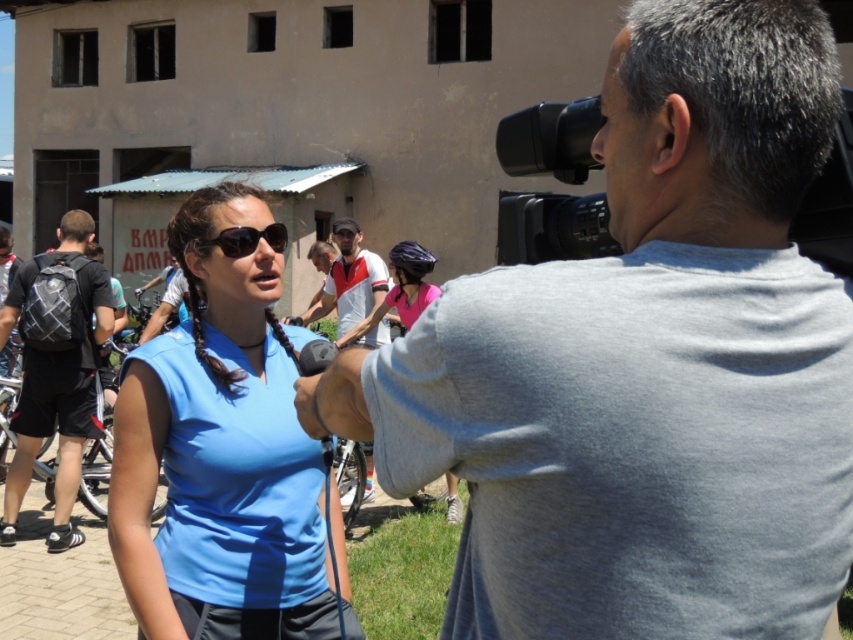
Does point (372, 300) come closer to viewer compared to point (230, 252)?

That is False.

Is white cotton shirt at center in front of black matte sunglasses at center?

No, white cotton shirt at center is behind black matte sunglasses at center.

Who is more forward, (335,308) or (235,252)?

Positioned in front is point (235,252).

At what (x,y) coordinates should I click in order to perform the action: click on white cotton shirt at center. Please return your answer as a coordinate pair (x, y). Image resolution: width=853 pixels, height=640 pixels. Looking at the image, I should click on (351, 289).

Who is shorter, black plastic video camera at upper right or white/red jersey at center?

Standing shorter between the two is white/red jersey at center.

Is point (596, 252) farther from viewer compared to point (380, 328)?

No, it is in front of (380, 328).

You are a GUI agent. You are given a task and a screenshot of the screen. Output one action in this format:
    pyautogui.click(x=<x>, y=<y>)
    Task: Click on the black plastic video camera at upper right
    The height and width of the screenshot is (640, 853).
    Given the screenshot: What is the action you would take?
    pyautogui.click(x=552, y=227)

Based on the photo, who is taller, white/red jersey at center or black matte sunglasses at center?

white/red jersey at center

In the scene shown: Who is more distant from viewer, (318, 310) or (223, 228)?

The point (318, 310) is behind.

Identify the location of white/red jersey at center. The height and width of the screenshot is (640, 853). (347, 282).

Identify the location of white/red jersey at center. This screenshot has height=640, width=853. (347, 282).